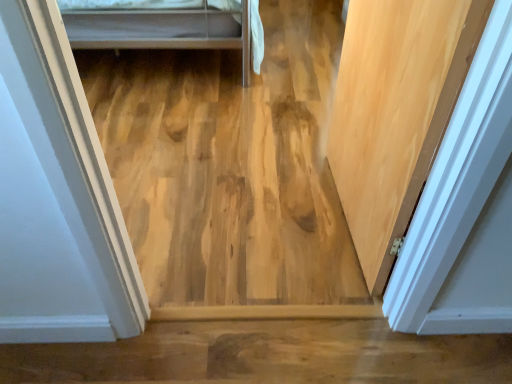
The image size is (512, 384). Identify the location of vacant space positioned to the left of natural wood door at right. (254, 206).